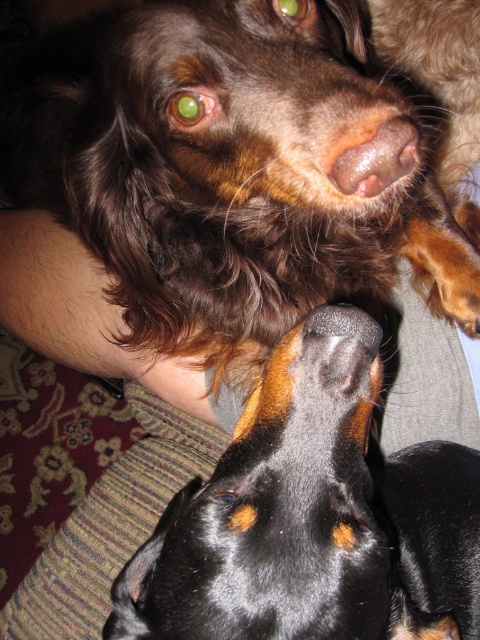
Question: Is brown shiny coat at upper center to the left of brown matte nose at center from the viewer's perspective?

Choices:
 (A) no
 (B) yes

Answer: (B)

Question: In this image, where is black glossy dog at center located relative to brown matte nose at center?

Choices:
 (A) right
 (B) left

Answer: (B)

Question: Which of the following is the closest to the observer?

Choices:
 (A) black glossy dog at center
 (B) brown shiny coat at upper center

Answer: (A)

Question: From the image, what is the correct spatial relationship of brown shiny coat at upper center in relation to brown matte nose at center?

Choices:
 (A) right
 (B) left

Answer: (B)

Question: Based on their relative distances, which object is farther from the brown shiny coat at upper center?

Choices:
 (A) brown matte nose at center
 (B) black glossy dog at center

Answer: (A)

Question: Which point is farther to the camera?

Choices:
 (A) pyautogui.click(x=348, y=164)
 (B) pyautogui.click(x=200, y=632)
 (C) pyautogui.click(x=478, y=20)

Answer: (C)